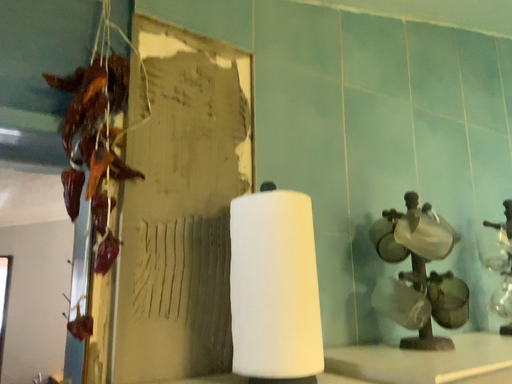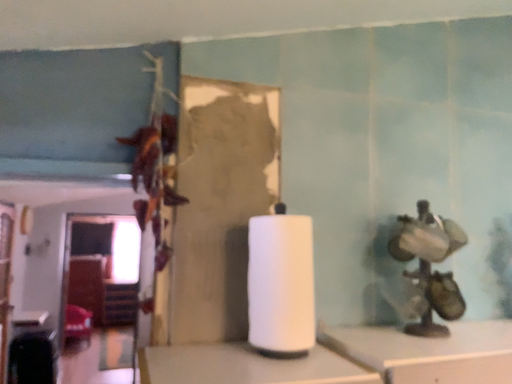
Question: Which way did the camera rotate in the video?

Choices:
 (A) rotated upward
 (B) rotated downward

Answer: (B)